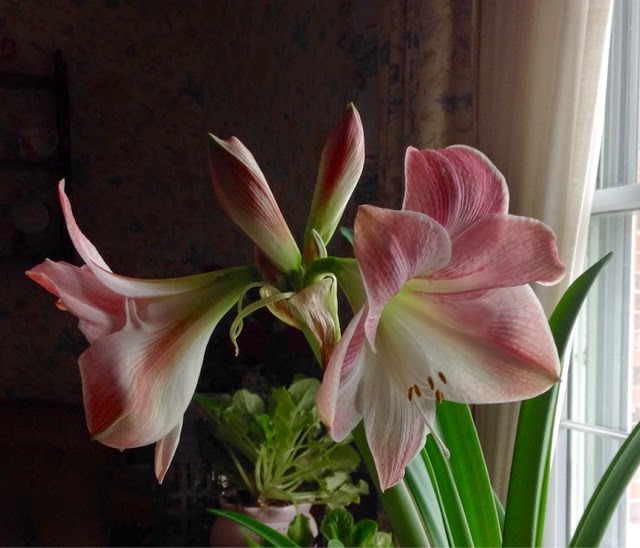
You are a GUI agent. You are given a task and a screenshot of the screen. Output one action in this format:
    pyautogui.click(x=<x>, y=<y>)
    Task: Click on the window
    The height and width of the screenshot is (548, 640).
    Given the screenshot: What is the action you would take?
    pyautogui.click(x=612, y=339)